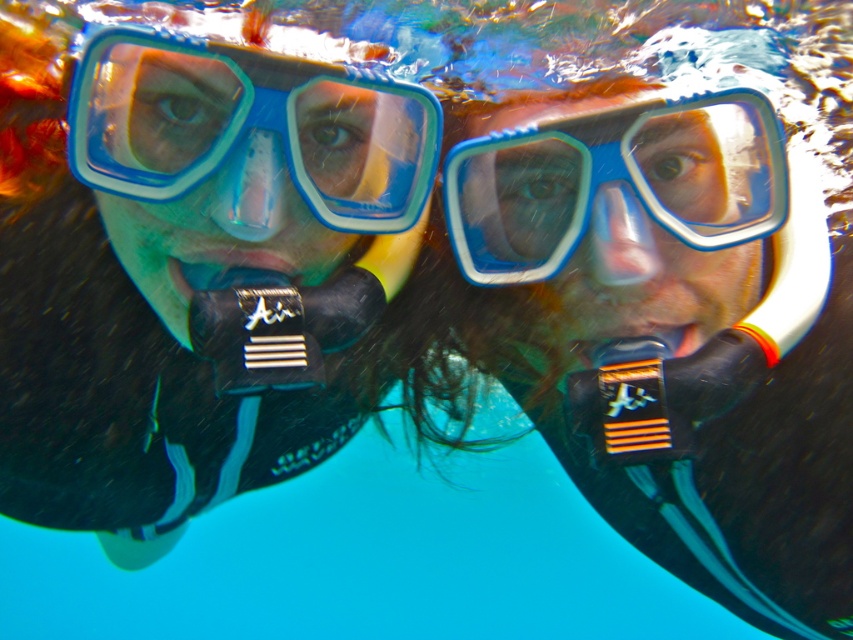
You are an underwater photographer with a camera that requires a minimum of 10 inches of space to operate. You notice two pairs of goggles at the center of your viewfinder, the blue plastic goggles at center and the blue rubber goggles at center. Can you operate your camera between them?

The distance between the blue plastic goggles at center and blue rubber goggles at center is 9.62 inches, which is less than the required 10 inches. Therefore, you cannot operate your camera between them.